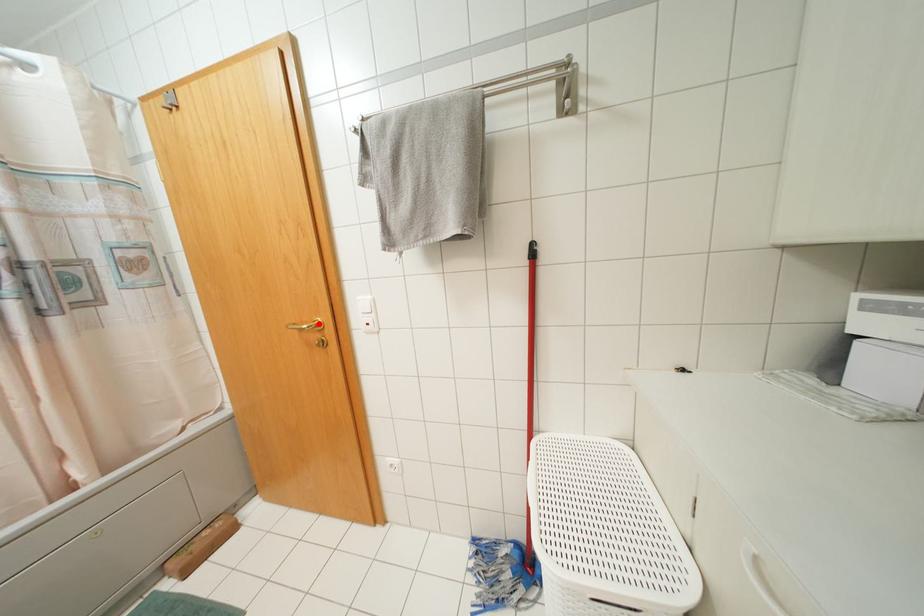
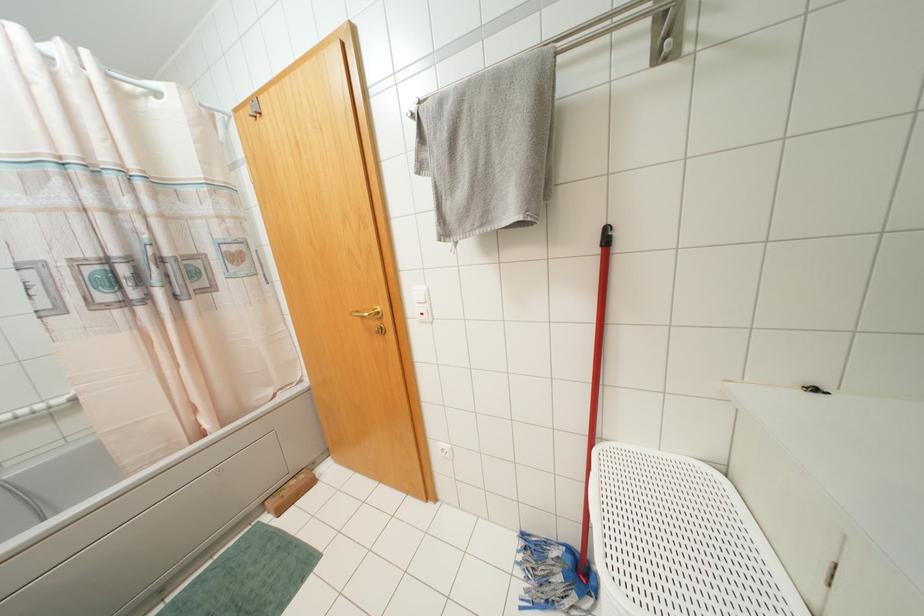
Where in the second image is the point corresponding to the highlighted location from the first image?

(378, 312)